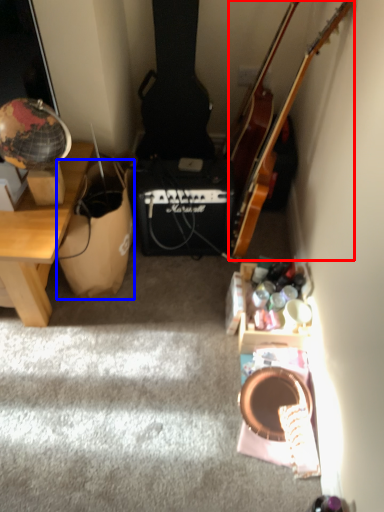
Question: Among these objects, which one is farthest to the camera, guitar (highlighted by a red box) or cardboard box (highlighted by a blue box)?

Choices:
 (A) guitar
 (B) cardboard box

Answer: (B)